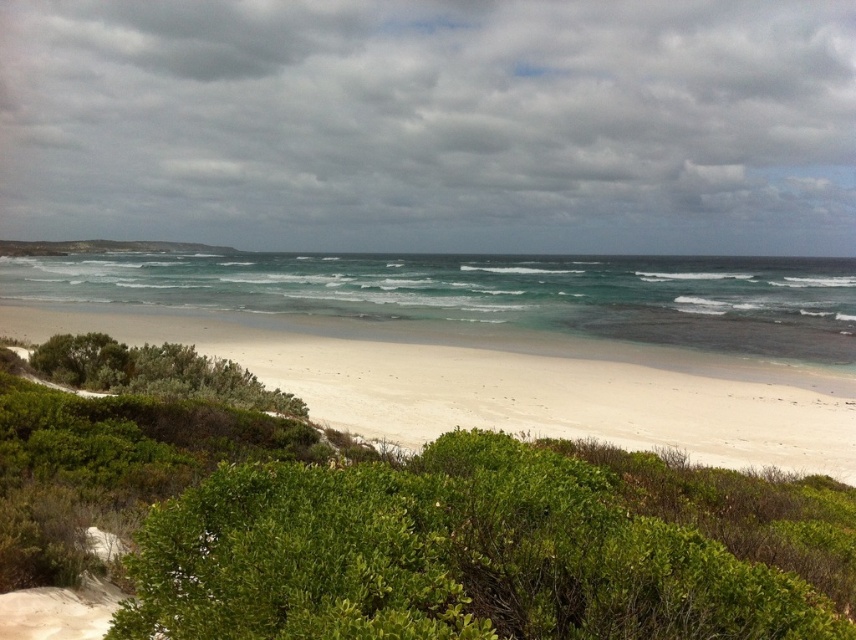
Question: Is clear blue water at center wider than white sandy beach at center?

Choices:
 (A) no
 (B) yes

Answer: (B)

Question: Which object is positioned farthest from the clear blue water at center?

Choices:
 (A) green leafy bush at lower center
 (B) white sandy beach at center

Answer: (A)

Question: Based on their relative distances, which object is farther from the clear blue water at center?

Choices:
 (A) green leafy bush at lower center
 (B) white sandy beach at center

Answer: (A)

Question: Does green leafy bush at lower center appear on the left side of clear blue water at center?

Choices:
 (A) no
 (B) yes

Answer: (A)

Question: From the image, what is the correct spatial relationship of green leafy bush at lower center in relation to white sandy beach at center?

Choices:
 (A) left
 (B) right

Answer: (B)

Question: Which point is farther to the camera?

Choices:
 (A) white sandy beach at center
 (B) green leafy bush at lower center
 (C) clear blue water at center

Answer: (C)